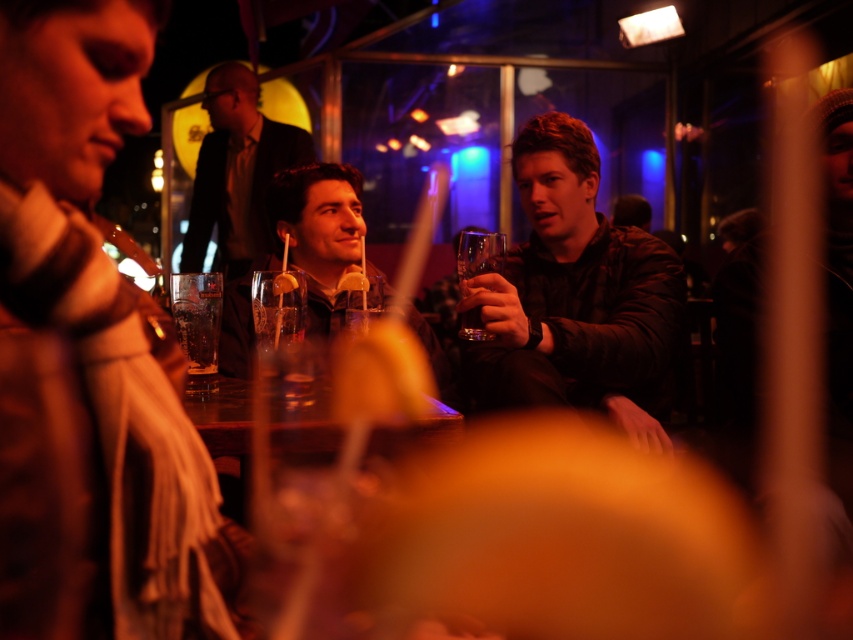
Question: Can you confirm if leather jacket at right is positioned to the left of clear glass with etched design at center?

Choices:
 (A) no
 (B) yes

Answer: (A)

Question: Among these objects, which one is nearest to the camera?

Choices:
 (A) dark brown leather jacket at upper center
 (B) leather jacket at right

Answer: (B)

Question: Is dark brown leather jacket at upper center thinner than clear glass with etched design at center?

Choices:
 (A) no
 (B) yes

Answer: (A)

Question: Estimate the real-world distances between objects in this image. Which object is farther from the matte black jacket at center?

Choices:
 (A) clear glass at center
 (B) dark brown leather jacket at upper center

Answer: (B)

Question: Which object appears closest to the camera in this image?

Choices:
 (A) transparent glass at right
 (B) clear glass with etched design at center

Answer: (B)

Question: Does matte black jacket at center have a greater width compared to transparent glass at right?

Choices:
 (A) yes
 (B) no

Answer: (A)